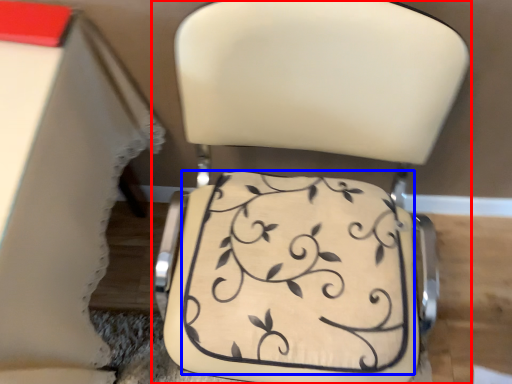
Question: Which point is further to the camera, chair (highlighted by a red box) or wedding cake (highlighted by a blue box)?

Choices:
 (A) chair
 (B) wedding cake

Answer: (B)